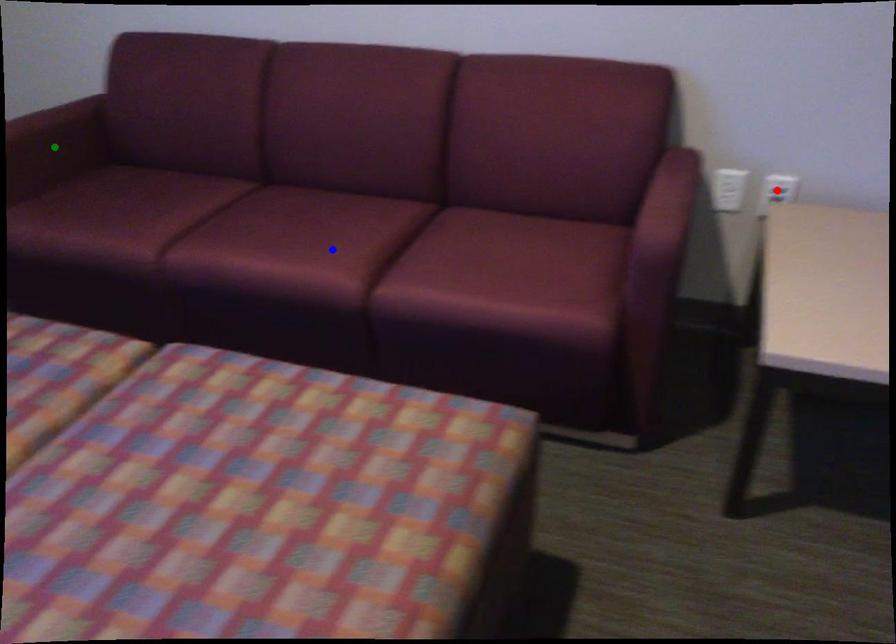
Order these from nearest to farthest:
red point | green point | blue point

blue point < red point < green point